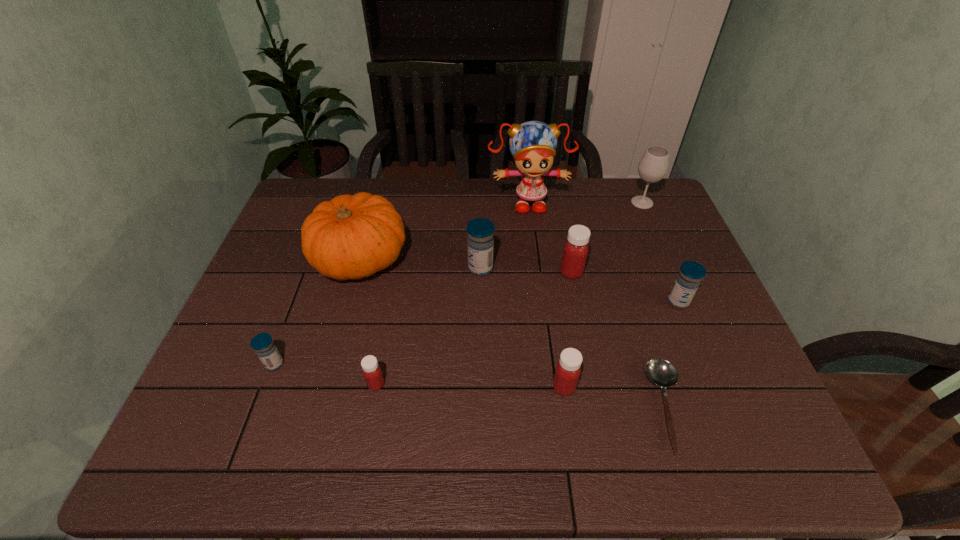
Locate an element on the screen. unoccupied position between the pumpkin and the smallest red medicine is located at coordinates 368,322.

Identify which object is located as the sixth nearest to the farthest blue medicine. Please provide its 2D coordinates. Your answer should be formatted as a tuple, i.e. [(x, y)], where the tuple contains the x and y coordinates of a point satisfying the conditions above.

[(661, 372)]

The height and width of the screenshot is (540, 960). In order to click on object that is the seventh closest to the leftmost blue medicine in this screenshot , I will do `click(661, 372)`.

This screenshot has width=960, height=540. In order to click on medicine that is the fifth closest to the second red medicine from left to right in this screenshot , I will do `click(263, 345)`.

Identify the location of the fourth closest medicine to the ladle. The image size is (960, 540). (480, 243).

Find the location of a particular element. blue medicine that is the third closest one to the gray ladle is located at coordinates (263, 345).

The width and height of the screenshot is (960, 540). I want to click on the second closest blue medicine relative to the smallest red medicine, so click(480, 243).

The image size is (960, 540). I want to click on red medicine object that ranks as the second closest to the farthest blue medicine, so click(568, 369).

Locate which red medicine is the closest to the tallest object. Please provide its 2D coordinates. Your answer should be formatted as a tuple, i.e. [(x, y)], where the tuple contains the x and y coordinates of a point satisfying the conditions above.

[(575, 251)]

Where is `free location that satisfies the following two spatial constraints: 1. on the back side of the rightmost red medicine; 2. on the left side of the wineglass`? free location that satisfies the following two spatial constraints: 1. on the back side of the rightmost red medicine; 2. on the left side of the wineglass is located at coordinates (557, 202).